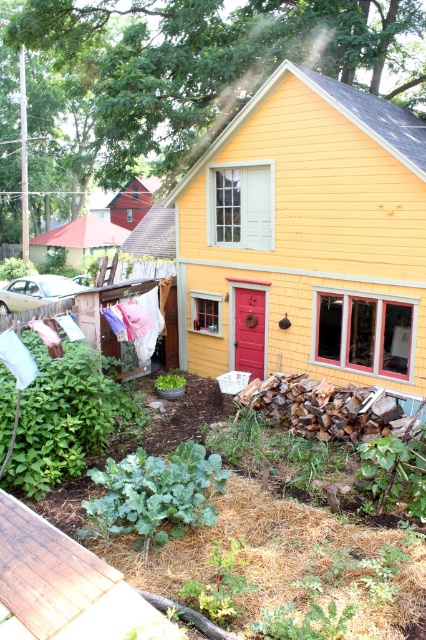
Which is more to the right, yellow wood shed at center or brown wooden deck at lower left?

yellow wood shed at center

Does yellow wood shed at center appear over brown wooden deck at lower left?

Yes, yellow wood shed at center is above brown wooden deck at lower left.

Who is more distant from viewer, (x=319, y=216) or (x=48, y=612)?

The point (x=319, y=216) is more distant.

Where is `yellow wood shed at center`? The height and width of the screenshot is (640, 426). yellow wood shed at center is located at coordinates (307, 237).